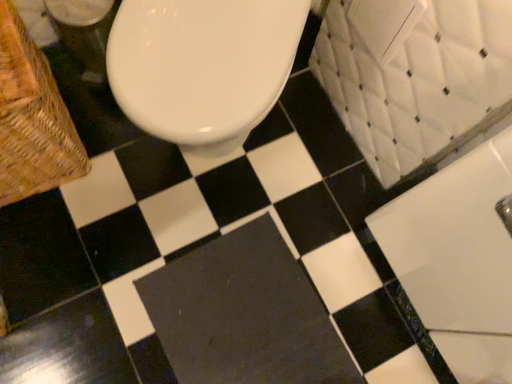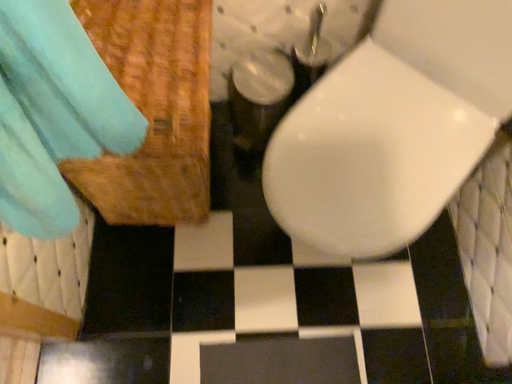
Question: How did the camera likely rotate when shooting the video?

Choices:
 (A) rotated upward
 (B) rotated downward

Answer: (A)